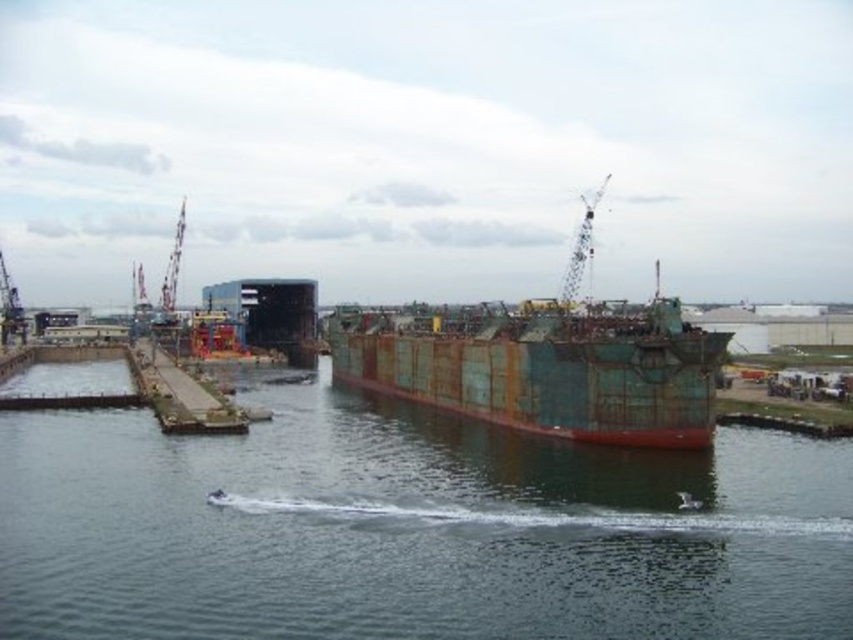
Does rusty metal cargo ship at center have a greater height compared to rusty metal crane at upper left?

Incorrect, rusty metal cargo ship at center's height is not larger of rusty metal crane at upper left's.

Image resolution: width=853 pixels, height=640 pixels. What do you see at coordinates (546, 368) in the screenshot? I see `rusty metal cargo ship at center` at bounding box center [546, 368].

Who is more distant from viewer, (479, 416) or (183, 204)?

Point (183, 204)

Identify the location of rusty metal cargo ship at center. Image resolution: width=853 pixels, height=640 pixels. (546, 368).

Is the position of rusty metal waterway at center more distant than that of rusty metal cargo ship at center?

No, rusty metal waterway at center is closer to the viewer.

Who is higher up, rusty metal waterway at center or rusty metal cargo ship at center?

rusty metal cargo ship at center

Where is `rusty metal waterway at center`? The height and width of the screenshot is (640, 853). rusty metal waterway at center is located at coordinates (410, 529).

Can you confirm if rusty metal cargo ship at center is bigger than rustic concrete dock at center?

Correct, rusty metal cargo ship at center is larger in size than rustic concrete dock at center.

Does rusty metal cargo ship at center have a lesser width compared to rustic concrete dock at center?

Correct, rusty metal cargo ship at center's width is less than rustic concrete dock at center's.

Between point (482, 307) and point (221, 422), which one is positioned in front?

Point (221, 422)

Where is `rusty metal cargo ship at center`? The image size is (853, 640). rusty metal cargo ship at center is located at coordinates (546, 368).